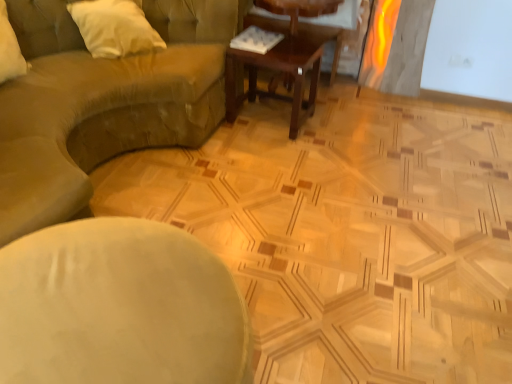
Question: From a real-world perspective, relative to white soft pillow at upper left, is wooden cocktail table at center vertically above or below?

Choices:
 (A) below
 (B) above

Answer: (A)

Question: Is wooden cocktail table at center in front of or behind white soft pillow at upper left in the image?

Choices:
 (A) front
 (B) behind

Answer: (B)

Question: Which of these objects is positioned farthest from the white soft pillow at upper left?

Choices:
 (A) wooden coffee table at center
 (B) wooden cocktail table at center
 (C) smooth green cushion at center
 (D) suede-like beige couch at upper left

Answer: (C)

Question: Which is nearer to the smooth green cushion at center?

Choices:
 (A) wooden cocktail table at center
 (B) white soft pillow at upper left
 (C) suede-like beige couch at upper left
 (D) wooden coffee table at center

Answer: (C)